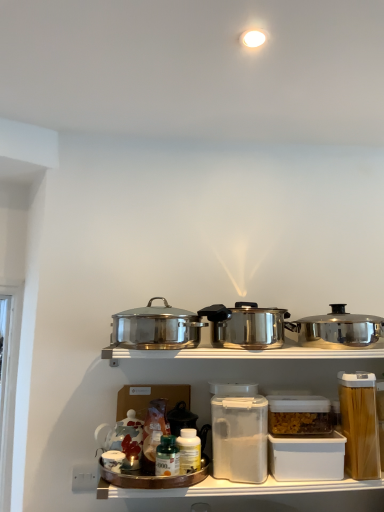
Question: Is green glass bottle at center, the first bottle from the left, a part of polished stainless steel pot at center, placed as the 2th kitchen appliance when sorted from right to left?

Choices:
 (A) yes
 (B) no

Answer: (B)

Question: Does polished stainless steel pot at center, placed as the 2th kitchen appliance when sorted from right to left, have a greater width compared to green glass bottle at center, the first bottle from the left?

Choices:
 (A) no
 (B) yes

Answer: (B)

Question: Is polished stainless steel pot at center, the 2th kitchen appliance when ordered from left to right, further to the viewer compared to green glass bottle at center, the first bottle from the left?

Choices:
 (A) no
 (B) yes

Answer: (B)

Question: Is polished stainless steel pot at center, placed as the 2th kitchen appliance when sorted from right to left, smaller than green glass bottle at center, the first bottle from the left?

Choices:
 (A) no
 (B) yes

Answer: (A)

Question: Does polished stainless steel pot at center, placed as the 2th kitchen appliance when sorted from right to left, have a lesser width compared to green glass bottle at center, the first bottle from the left?

Choices:
 (A) yes
 (B) no

Answer: (B)

Question: From a real-world perspective, is green glass bottle at center, positioned as the second bottle in right-to-left order, positioned above or below white plastic bottle at center, the 1th bottle in the right-to-left sequence?

Choices:
 (A) above
 (B) below

Answer: (B)

Question: In terms of height, does green glass bottle at center, the first bottle from the left, look taller or shorter compared to white plastic bottle at center, the second bottle in the left-to-right sequence?

Choices:
 (A) short
 (B) tall

Answer: (A)

Question: Considering the positions of point (155, 471) and point (183, 472), is point (155, 471) closer or farther from the camera than point (183, 472)?

Choices:
 (A) farther
 (B) closer

Answer: (A)

Question: In the image, is green glass bottle at center, the first bottle from the left, on the left side or the right side of white plastic bottle at center, the 1th bottle in the right-to-left sequence?

Choices:
 (A) left
 (B) right

Answer: (A)

Question: Choose the correct answer: Is white plastic container at lower center inside polished stainless steel pot at center, placed as the first kitchen appliance when sorted from left to right, or outside it?

Choices:
 (A) outside
 (B) inside

Answer: (A)

Question: In terms of width, does white plastic container at lower center look wider or thinner when compared to polished stainless steel pot at center, placed as the first kitchen appliance when sorted from left to right?

Choices:
 (A) thin
 (B) wide

Answer: (A)

Question: From a real-world perspective, is white plastic container at lower center physically located above or below polished stainless steel pot at center, placed as the first kitchen appliance when sorted from left to right?

Choices:
 (A) below
 (B) above

Answer: (A)

Question: Does point (274, 438) appear closer or farther from the camera than point (187, 343)?

Choices:
 (A) closer
 (B) farther

Answer: (A)

Question: Is white plastic container at lower center wider or thinner than clear plastic container at center, the 2th appliance when ordered from left to right?

Choices:
 (A) wide
 (B) thin

Answer: (B)

Question: Is white plastic container at lower center inside the boundaries of clear plastic container at center, the 2th appliance when ordered from left to right, or outside?

Choices:
 (A) inside
 (B) outside

Answer: (B)